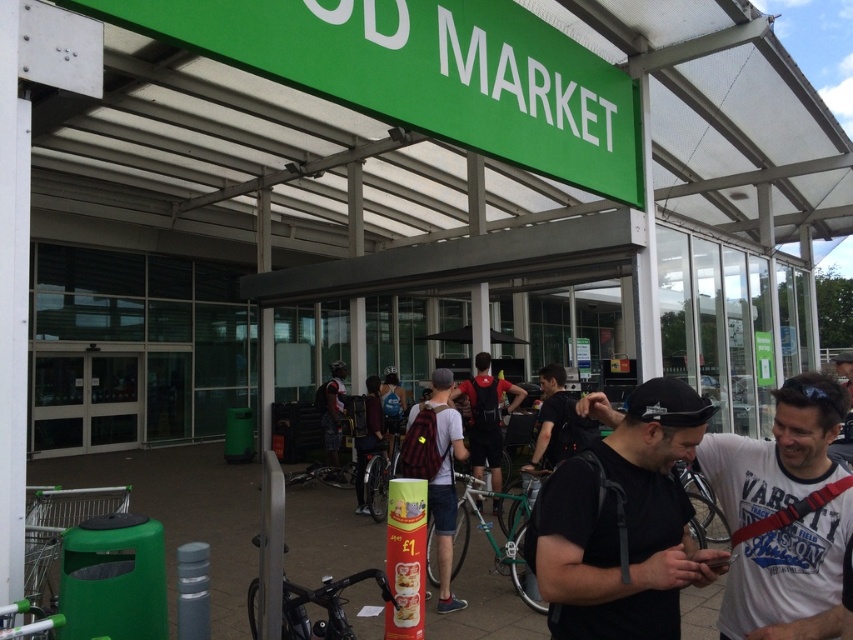
Question: Can you confirm if green plastic sign at upper center is wider than red fabric backpack at center?

Choices:
 (A) yes
 (B) no

Answer: (A)

Question: Is black matte t-shirt at center thinner than red fabric backpack at center?

Choices:
 (A) yes
 (B) no

Answer: (A)

Question: Which of the following is the farthest from the observer?

Choices:
 (A) red fabric backpack at center
 (B) black matte t-shirt at center

Answer: (A)

Question: Estimate the real-world distances between objects in this image. Which object is farther from the white cotton t-shirt at lower right?

Choices:
 (A) green plastic sign at upper center
 (B) plaid fabric backpack at center
 (C) camouflage-patterned shorts at center
 (D) black matte t-shirt at center

Answer: (C)

Question: Considering the relative positions of green plastic sign at upper center and white cotton t-shirt at lower right in the image provided, where is green plastic sign at upper center located with respect to white cotton t-shirt at lower right?

Choices:
 (A) below
 (B) above

Answer: (B)

Question: Among these points, which one is farthest from the camera?

Choices:
 (A) (791, 396)
 (B) (656, 460)

Answer: (A)